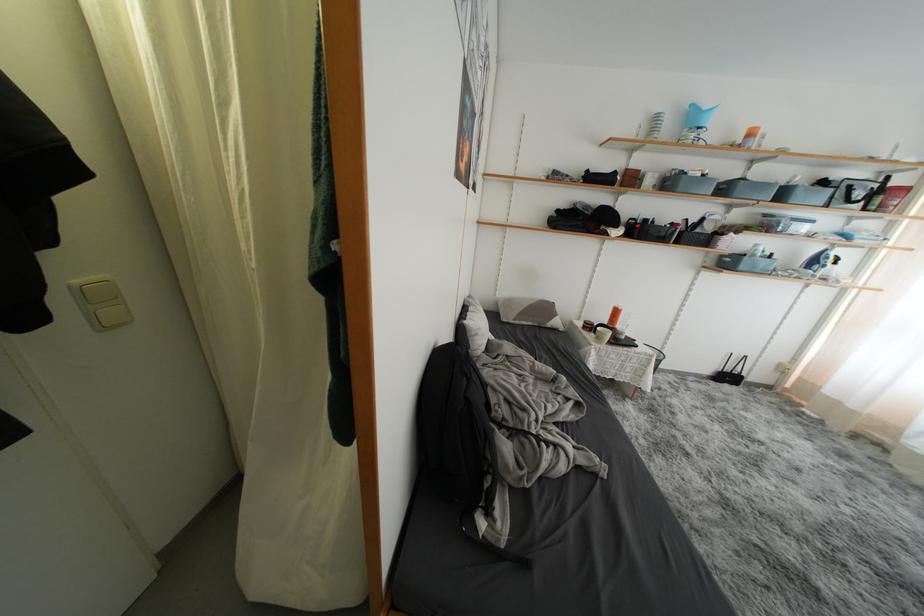
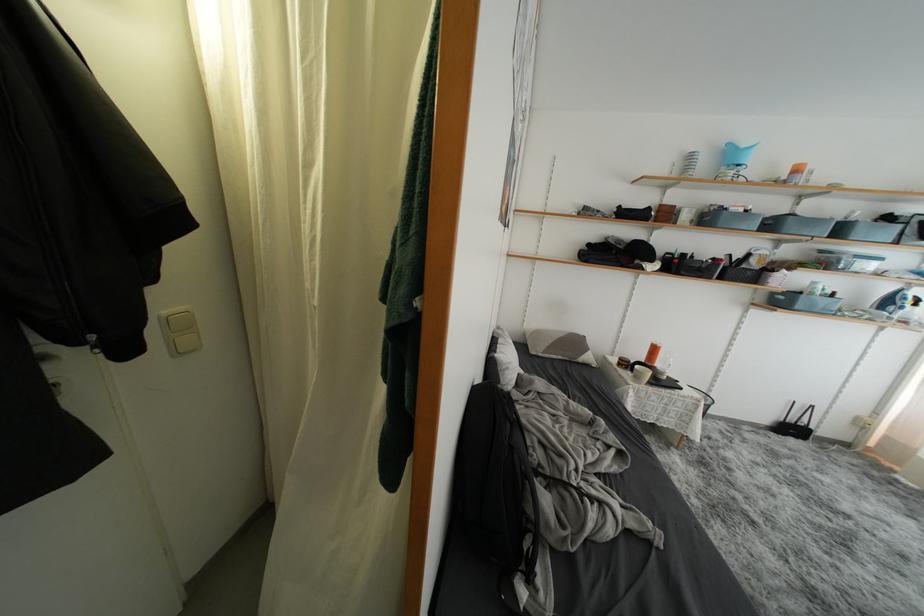
Where in the second image is the point corresponding to [772,219] from the first image?

(829, 256)